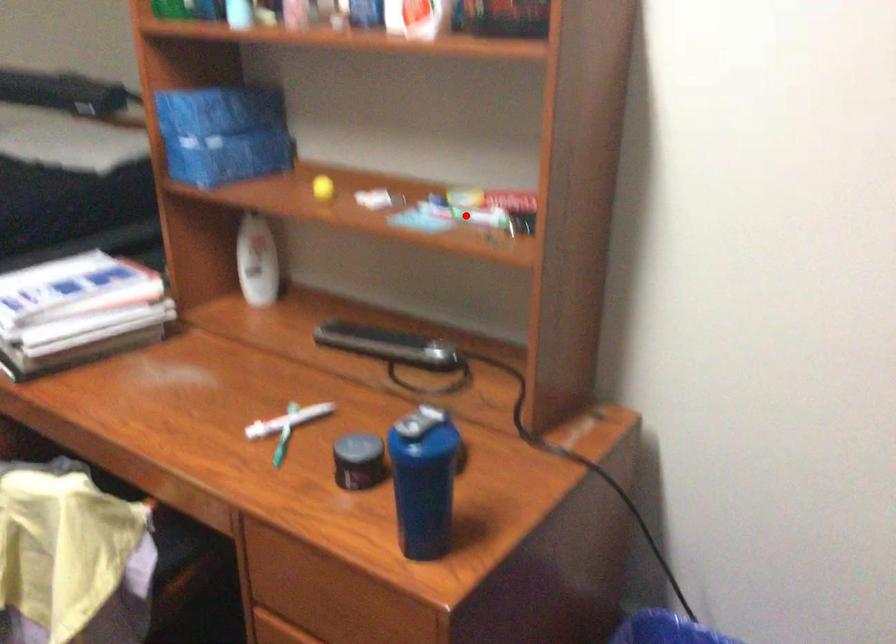
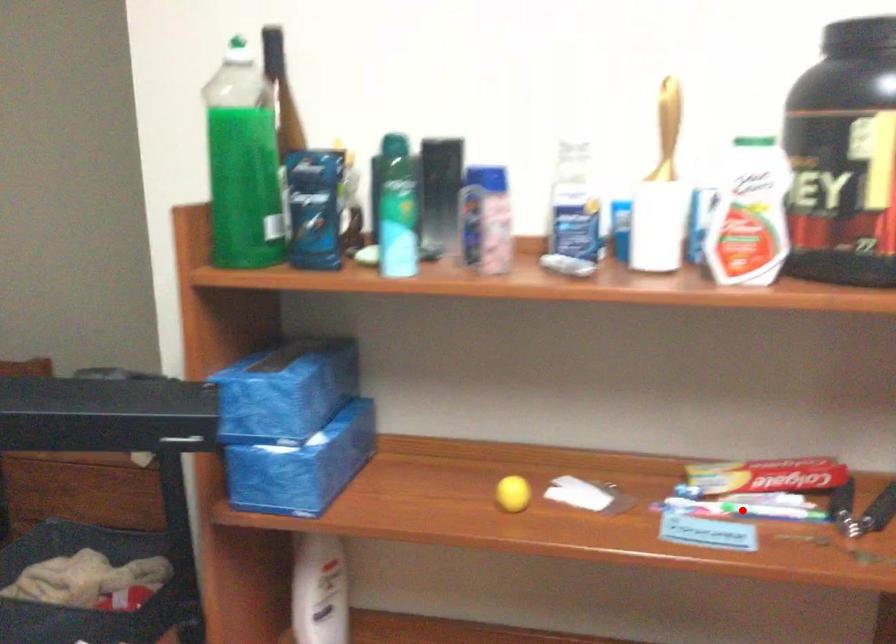
I am providing you with two images of the same scene from different viewpoints. A red point is marked on the first image and another point is marked on the second image. Are the points marked in image1 and image2 representing the same 3D position?

Yes